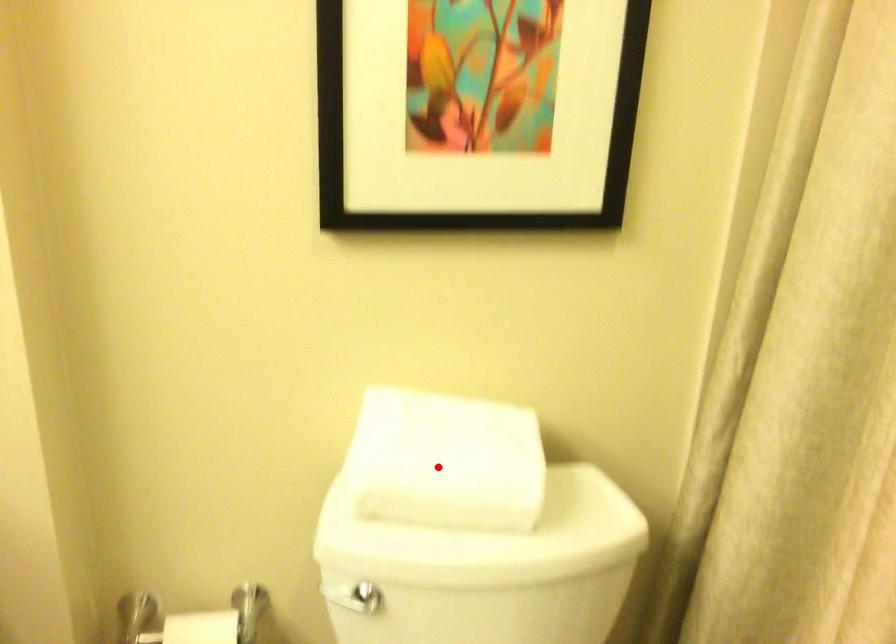
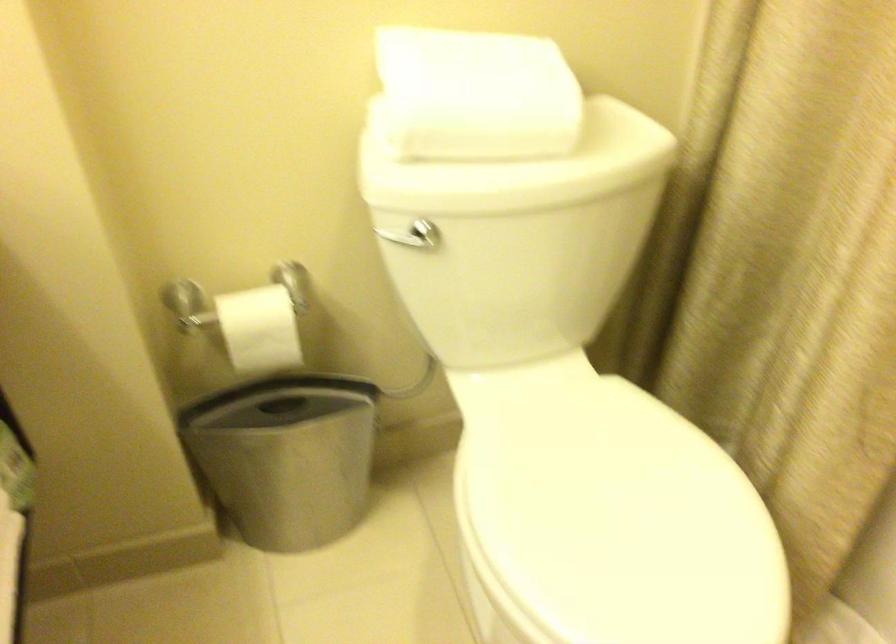
Question: I am providing you with two images of the same scene from different viewpoints. A red point is marked on the first image. Is the red point's position out of view in image 2?

Choices:
 (A) Yes
 (B) No

Answer: (B)